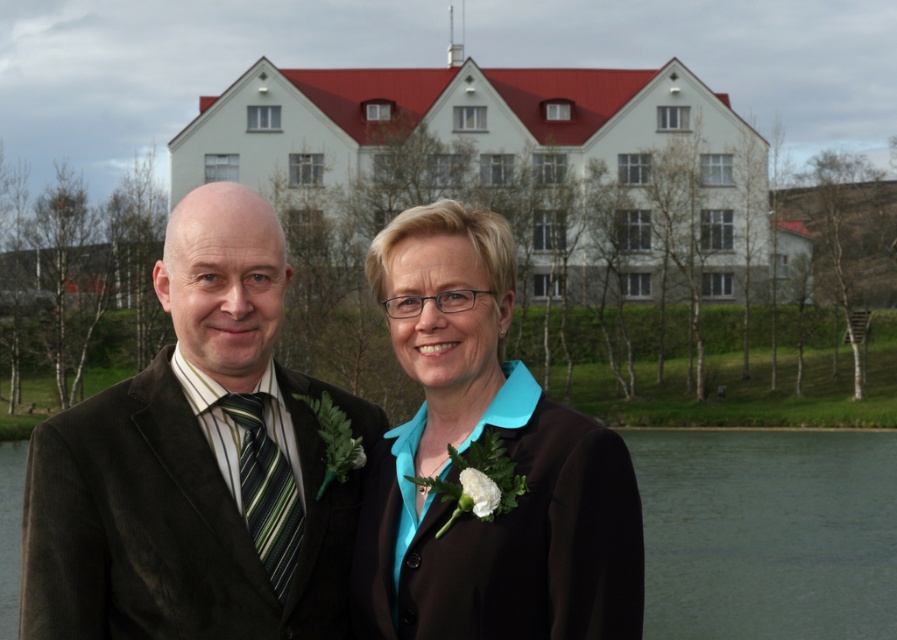
Between transparent water at lower center and green striped tie at left, which one is positioned lower?

transparent water at lower center

How much distance is there between transparent water at lower center and green striped tie at left?

transparent water at lower center and green striped tie at left are 25.92 meters apart from each other.

Who is more distant from viewer, (718, 444) or (251, 465)?

The point (718, 444) is behind.

You are a GUI agent. You are given a task and a screenshot of the screen. Output one action in this format:
    pyautogui.click(x=<x>, y=<y>)
    Task: Click on the transparent water at lower center
    The image size is (897, 640).
    Given the screenshot: What is the action you would take?
    pyautogui.click(x=767, y=532)

Can you confirm if brown corduroy suit at left is thinner than teal matte blazer at center?

In fact, brown corduroy suit at left might be wider than teal matte blazer at center.

Between point (286, 396) and point (611, 456), which one is positioned behind?

The point (286, 396) is behind.

Between point (372, 422) and point (476, 384), which one is positioned in front?

Point (476, 384) is more forward.

This screenshot has width=897, height=640. Identify the location of brown corduroy suit at left. (196, 464).

Does teal matte blazer at center appear on the right side of green striped tie at left?

Indeed, teal matte blazer at center is positioned on the right side of green striped tie at left.

The height and width of the screenshot is (640, 897). What are the coordinates of `teal matte blazer at center` in the screenshot? It's located at (503, 458).

This screenshot has height=640, width=897. What are the coordinates of `teal matte blazer at center` in the screenshot? It's located at (503, 458).

In order to click on teal matte blazer at center in this screenshot , I will do `click(503, 458)`.